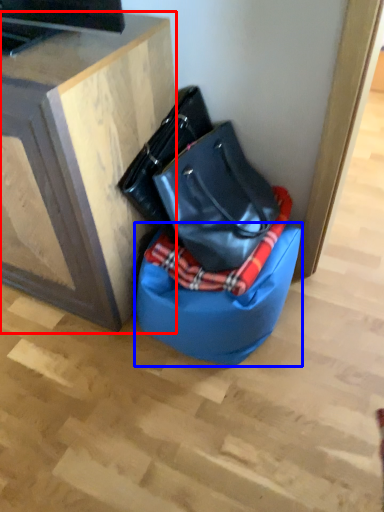
Question: Which object appears farthest to the camera in this image, furniture (highlighted by a red box) or bean bag chair (highlighted by a blue box)?

Choices:
 (A) furniture
 (B) bean bag chair

Answer: (B)